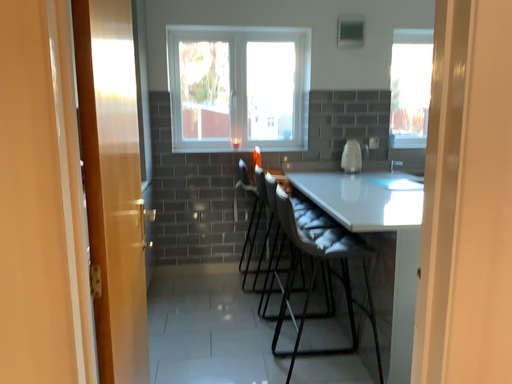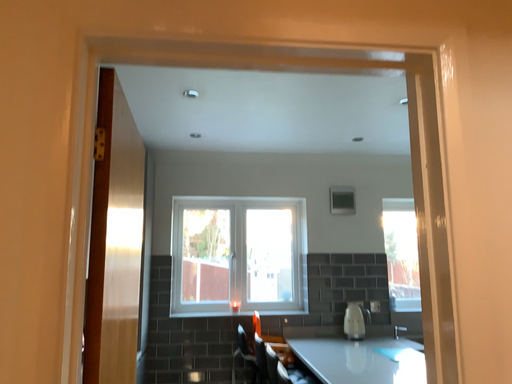
Question: How did the camera likely rotate when shooting the video?

Choices:
 (A) rotated downward
 (B) rotated upward

Answer: (B)